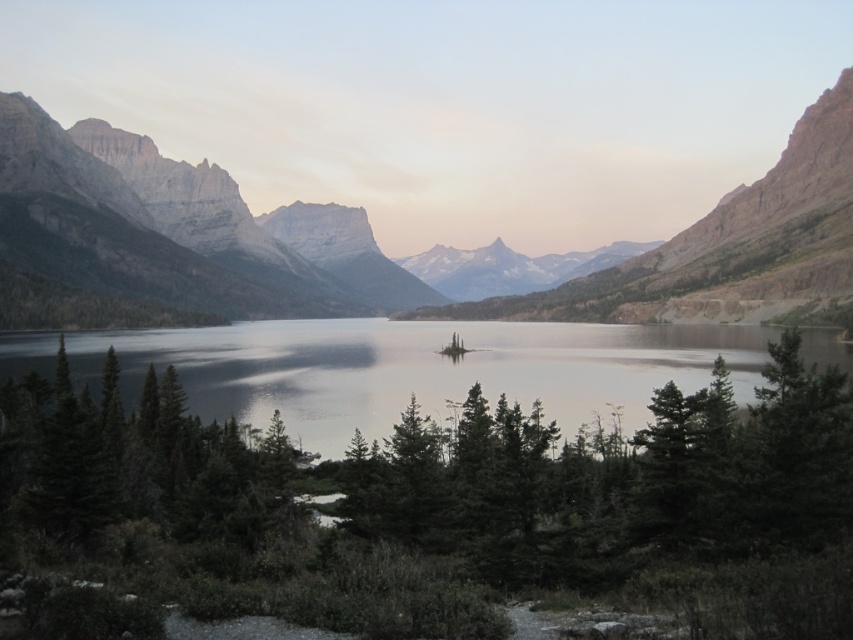
You are an artist setting up your easel to paint the landscape. You want to ensure both the green matte tree at center and the matte gray rock at center are clearly visible in your painting. Given their sizes, which object should you position closer to the foreground to maintain their visibility?

The green matte tree at center occupies less space than the matte gray rock at center, so to maintain visibility, the green matte tree at center should be positioned closer to the foreground since smaller objects need to be nearer to appear prominent in the painting.

You are standing on the peninsula and want to walk to the clear water at center. Is the green matte tree at center blocking your path? Explain.

The green matte tree at center is closer to the viewer than the clear water at center, so the tree is in front of the water. Therefore, the green matte tree at center would block your path to the clear water at center.

You are standing on the peninsula and want to know if the green matte tree at center is taller than the clear water at center. Can you determine this based on the scene?

The green matte tree at center is shorter than clear water at center, so the tree is not taller than the water.